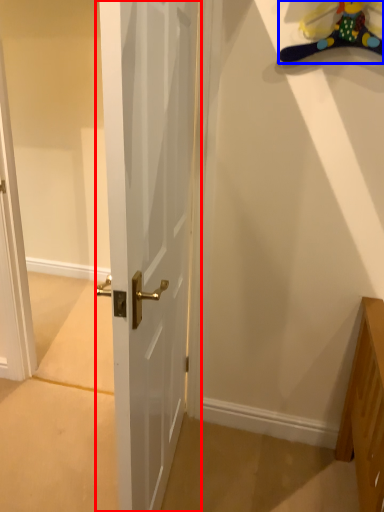
Question: Among these objects, which one is nearest to the camera, door (highlighted by a red box) or toy (highlighted by a blue box)?

Choices:
 (A) door
 (B) toy

Answer: (A)